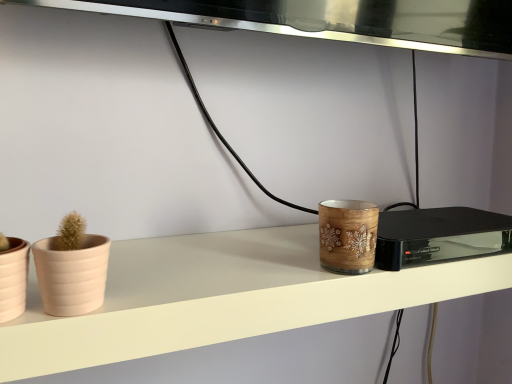
What are the coordinates of `vacant space that is to the left of wooden candle holder at center` in the screenshot? It's located at (242, 271).